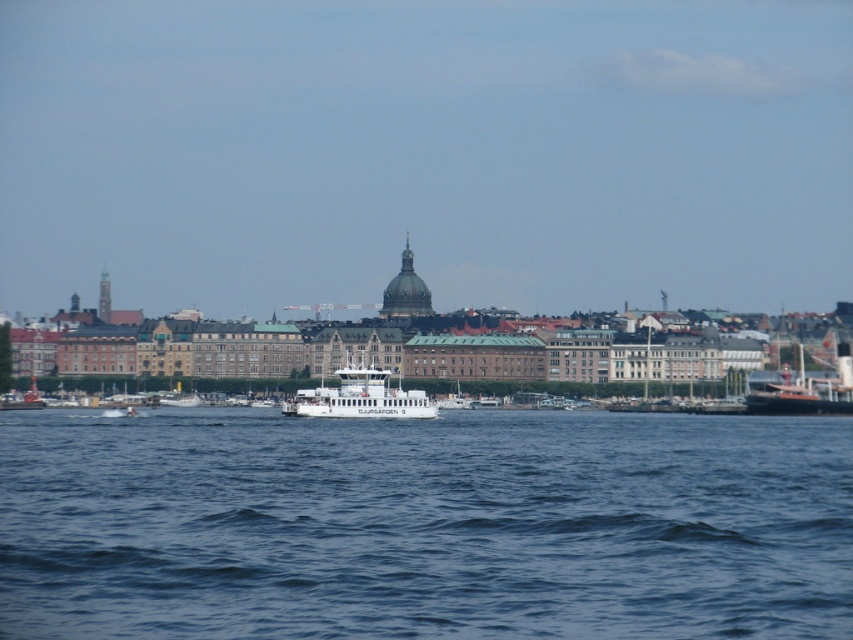
You are a photographer planning to capture both the white glossy ferry at center and the rustic wooden ship at right in a single frame. Given their relative sizes, which vessel should you position closer to the camera to ensure both appear balanced in the photograph?

To balance the white glossy ferry at center and the rustic wooden ship at right in the photograph, position the rustic wooden ship at right closer to the camera since the white glossy ferry at center is wider. This adjustment will make both vessels appear similar in size within the frame.